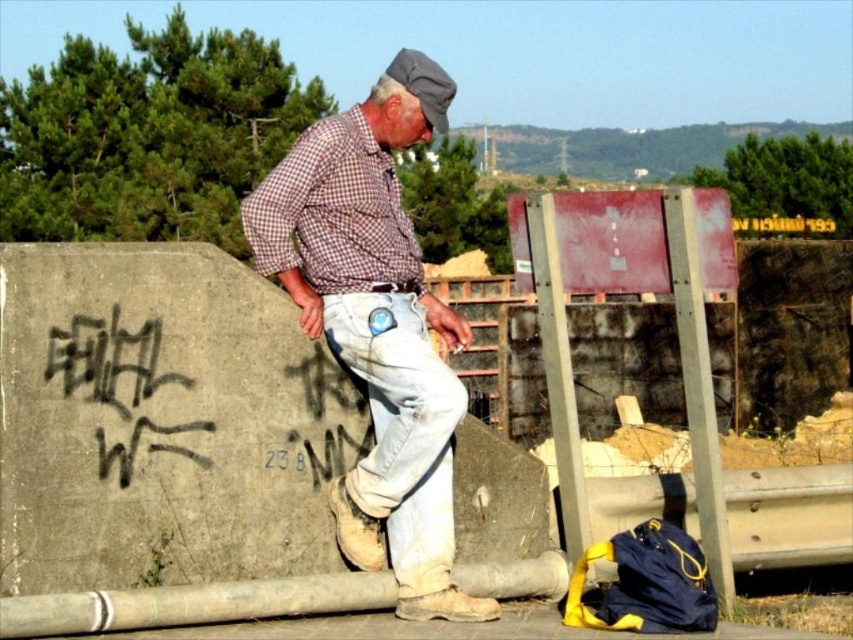
You are a fashion designer observing the scene. You want to create a new clothing line inspired by the checkered fabric shirt at center and the black graffiti at left. Which of the two has a larger width in the image?

The checkered fabric shirt at center has a larger width than the black graffiti at left according to the description.

You are a photographer trying to capture a portrait of the man in the checkered fabric shirt at center and the black graffiti at left. Since you want to ensure both are in focus, which object should you position closer to the camera to achieve depth of field? Please explain your reasoning based on their sizes in the image.

The checkered fabric shirt at center is much taller than the black graffiti at left. To achieve depth of field where both are in focus, you should position the checkered fabric shirt at center closer to the camera because it is larger in the frame, allowing the graffiti to stay in focus while maintaining the subject prominence.